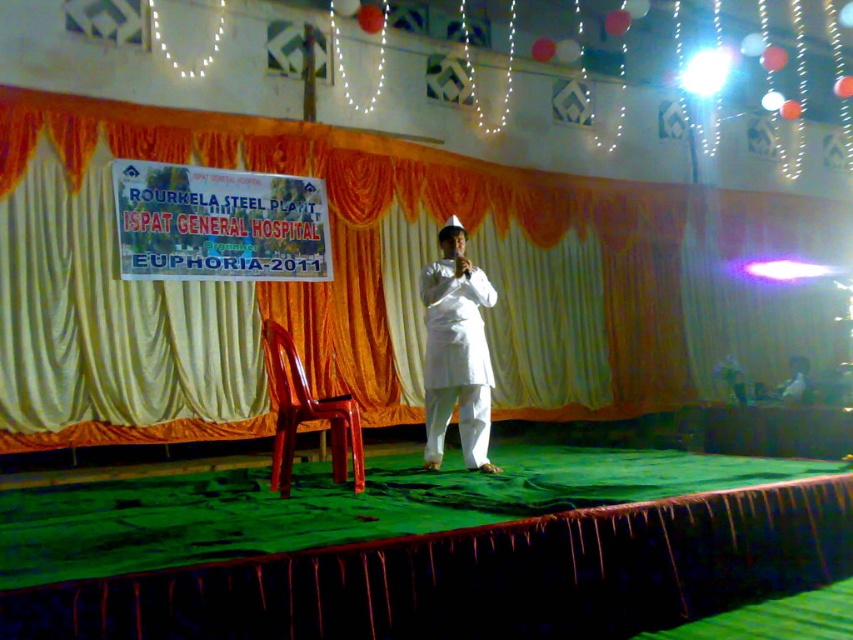
Question: Is orange fabric curtain at upper center above white cotton kurta at center?

Choices:
 (A) no
 (B) yes

Answer: (B)

Question: Which point is closer to the camera?

Choices:
 (A) orange fabric curtain at upper center
 (B) white cotton kurta at center

Answer: (B)

Question: Which point is farther to the camera?

Choices:
 (A) (27, 100)
 (B) (312, 408)

Answer: (A)

Question: Observing the image, what is the correct spatial positioning of orange fabric curtain at upper center in reference to white cotton kurta at center?

Choices:
 (A) below
 (B) above

Answer: (B)

Question: Which point is closer to the camera?

Choices:
 (A) white cotton kurta at center
 (B) glossy plastic chair at center
 (C) orange fabric curtain at upper center

Answer: (B)

Question: Can you confirm if orange fabric curtain at upper center is positioned to the right of glossy plastic chair at center?

Choices:
 (A) no
 (B) yes

Answer: (B)